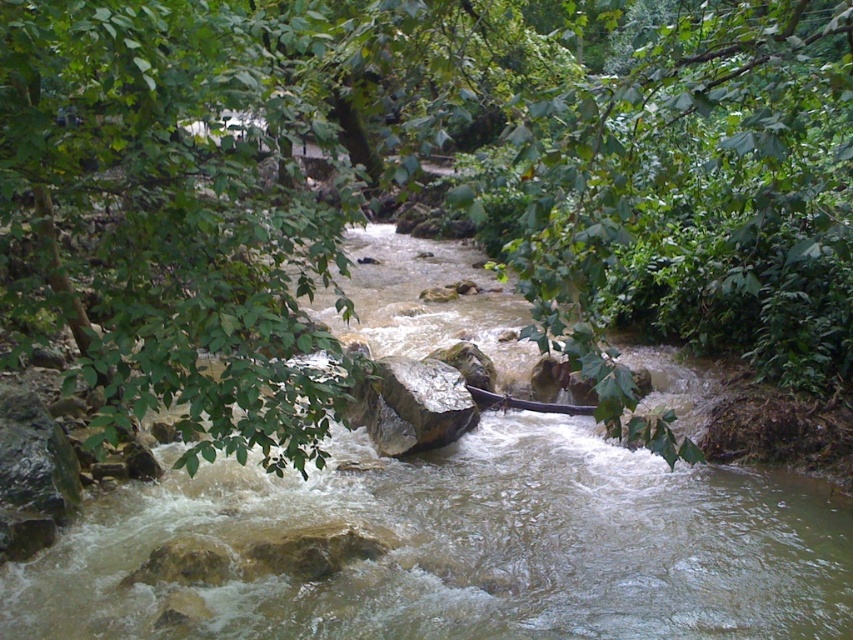
You are standing at the edge of the river and see two points in the water. The first point is located at coordinates point (521, 554) and the second point is at point (555, 404). Which point is closer to your current position?

Point (521, 554) is closer to the camera than point (555, 404), so the first point is closer to your current position.

You are standing on a bridge overlooking the river and want to place a small floating device between the brown rocky stream at center and the brown wooden canoe at center. Which object should you aim for if you want the device to be closer to the viewer?

You should aim for the brown rocky stream at center because it is closer to the viewer than the brown wooden canoe at center.

You are planning to cross the river using the brown wooden canoe at center. The brown rocky stream at center is in your path. Can the canoe fit through the narrowest part of the stream?

The brown rocky stream at center is larger in size than the brown wooden canoe at center, so yes, the canoe can fit through the narrowest part of the stream since the stream is wider than the canoe.